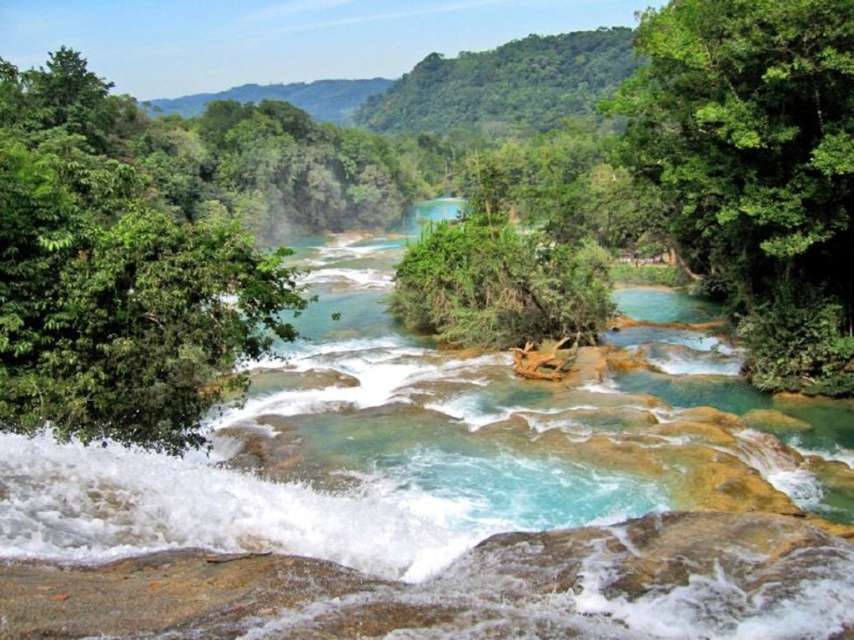
You are a bird seeking a higher vantage point to survey the waterfall area. Which tree would provide a better view, the green leafy tree at left or the green leafy tree at upper right?

The green leafy tree at left is much taller than the green leafy tree at upper right, so it would provide a better vantage point for surveying the waterfall area.

You are standing at the base of the waterfall and notice two green leafy trees in the scene. Which tree, the green leafy tree at left or the green leafy tree at upper right, is closer to you?

The green leafy tree at left is closer to you because it is positioned over the green leafy tree at upper right, indicating it is in a lower layer of the scene.